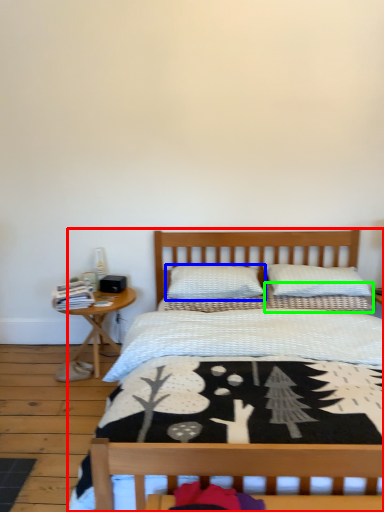
Question: Which is nearer to the bed (highlighted by a red box)? pillow (highlighted by a blue box) or pillow (highlighted by a green box).

Choices:
 (A) pillow
 (B) pillow

Answer: (B)